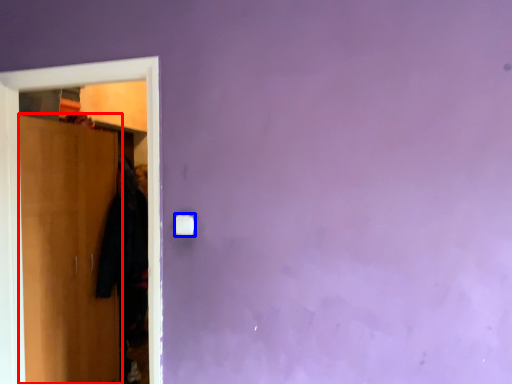
Question: Which point is further to the camera, door (highlighted by a red box) or light switch (highlighted by a blue box)?

Choices:
 (A) door
 (B) light switch

Answer: (A)